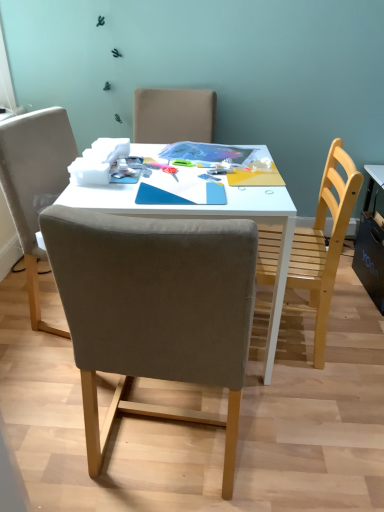
Question: Is suede-like beige chair at center, which is the second chair from right to left, with white glossy table at center?

Choices:
 (A) yes
 (B) no

Answer: (B)

Question: Considering the relative sizes of suede-like beige chair at center, which is the second chair from right to left, and white glossy table at center in the image provided, is suede-like beige chair at center, which is the second chair from right to left, thinner than white glossy table at center?

Choices:
 (A) yes
 (B) no

Answer: (A)

Question: Is suede-like beige chair at center, acting as the 1th chair starting from the left, positioned in front of white glossy table at center?

Choices:
 (A) yes
 (B) no

Answer: (A)

Question: Would you say suede-like beige chair at center, which is the second chair from right to left, is outside white glossy table at center?

Choices:
 (A) yes
 (B) no

Answer: (A)

Question: Is suede-like beige chair at center, which is the second chair from right to left, shorter than white glossy table at center?

Choices:
 (A) no
 (B) yes

Answer: (A)

Question: Is point (299, 249) closer or farther from the camera than point (74, 245)?

Choices:
 (A) farther
 (B) closer

Answer: (A)

Question: From the image's perspective, is wooden chair at right, the 1th chair viewed from the right, positioned above or below suede-like beige chair at center, acting as the 1th chair starting from the left?

Choices:
 (A) below
 (B) above

Answer: (B)

Question: In terms of width, does wooden chair at right, the 1th chair viewed from the right, look wider or thinner when compared to suede-like beige chair at center, which is the second chair from right to left?

Choices:
 (A) thin
 (B) wide

Answer: (A)

Question: Choose the correct answer: Is wooden chair at right, the 1th chair viewed from the right, inside suede-like beige chair at center, acting as the 1th chair starting from the left, or outside it?

Choices:
 (A) outside
 (B) inside

Answer: (A)

Question: Does point (221, 344) appear closer or farther from the camera than point (311, 293)?

Choices:
 (A) farther
 (B) closer

Answer: (B)

Question: Is suede-like beige chair at center, which is the second chair from right to left, taller or shorter than wooden chair at right, positioned as the second chair in left-to-right order?

Choices:
 (A) tall
 (B) short

Answer: (A)

Question: Looking at their shapes, would you say suede-like beige chair at center, which is the second chair from right to left, is wider or thinner than wooden chair at right, the 1th chair viewed from the right?

Choices:
 (A) wide
 (B) thin

Answer: (A)

Question: From the image's perspective, is suede-like beige chair at center, which is the second chair from right to left, positioned above or below wooden chair at right, the 1th chair viewed from the right?

Choices:
 (A) below
 (B) above

Answer: (A)

Question: In the image, is white glossy table at center on the left side or the right side of suede-like beige chair at center, which is the second chair from right to left?

Choices:
 (A) left
 (B) right

Answer: (B)

Question: From their relative heights in the image, would you say white glossy table at center is taller or shorter than suede-like beige chair at center, which is the second chair from right to left?

Choices:
 (A) tall
 (B) short

Answer: (B)